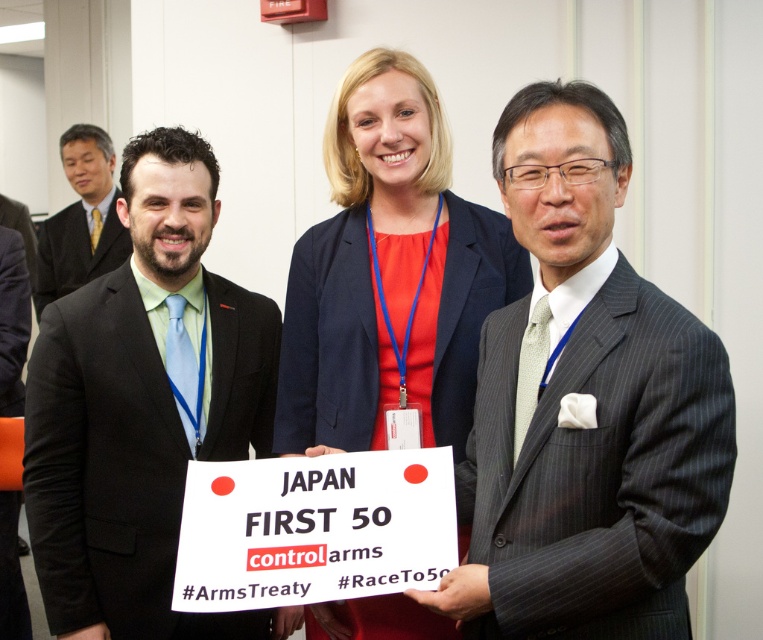
Can you confirm if black suit at left is taller than gray pinstripe suit at right?

Correct, black suit at left is much taller as gray pinstripe suit at right.

Can you confirm if black suit at left is smaller than gray pinstripe suit at right?

No.

Is point (185, 173) positioned in front of point (684, 472)?

No, (185, 173) is further to viewer.

Identify the location of black suit at left. The image size is (763, 640). point(143,406).

Who is more forward, [501,576] or [285,316]?

Positioned in front is point [501,576].

Is point (675, 404) positioned in front of point (382, 342)?

Yes, it is.

Is point (557, 593) closer to viewer compared to point (359, 128)?

That is True.

Find the location of `gray pinstripe suit at right`. gray pinstripe suit at right is located at coordinates (599, 468).

Does point (607, 536) lie behind point (308, 488)?

No, (607, 536) is in front of (308, 488).

Consider the image. Is gray pinstripe suit at right below white paper sign at center?

Actually, gray pinstripe suit at right is above white paper sign at center.

Which is behind, point (597, 403) or point (417, 529)?

Point (417, 529)

This screenshot has width=763, height=640. In order to click on gray pinstripe suit at right in this screenshot , I will do `click(599, 468)`.